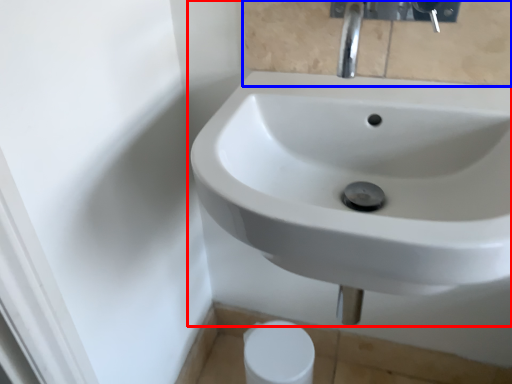
Question: Which object appears farthest to the camera in this image, sink (highlighted by a red box) or mirror (highlighted by a blue box)?

Choices:
 (A) sink
 (B) mirror

Answer: (B)